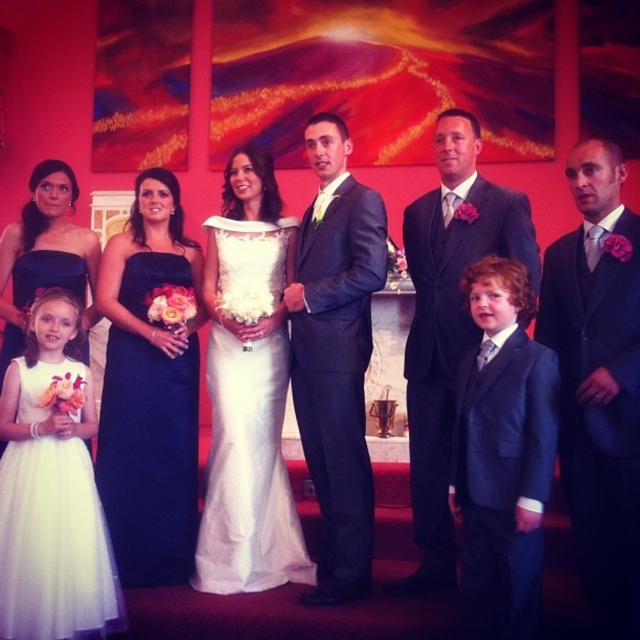
Question: Is navy satin dress at left thinner than white tulle dress at lower left?

Choices:
 (A) yes
 (B) no

Answer: (A)

Question: Estimate the real-world distances between objects in this image. Which object is closer to the matte navy blue dress at left?

Choices:
 (A) black satin suit at center
 (B) white tulle dress at lower left
 (C) matte black suit at center

Answer: (B)

Question: Which object is closer to the camera taking this photo?

Choices:
 (A) black satin suit at center
 (B) dark gray suit at center
 (C) matte black suit at center
 (D) white tulle dress at lower left

Answer: (A)

Question: Among these objects, which one is farthest from the camera?

Choices:
 (A) white satin dress at center
 (B) white tulle dress at lower left
 (C) matte navy blue dress at left

Answer: (A)

Question: Is white satin dress at center bigger than matte navy blue dress at left?

Choices:
 (A) yes
 (B) no

Answer: (B)

Question: Is dark gray suit at center below navy satin dress at left?

Choices:
 (A) yes
 (B) no

Answer: (B)